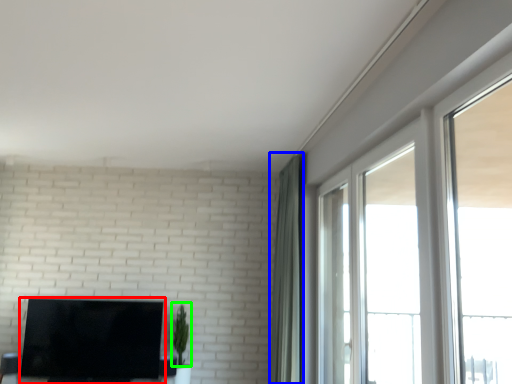
Question: Considering the real-world distances, which object is closest to television (highlighted by a red box)? curtain (highlighted by a blue box) or plant (highlighted by a green box).

Choices:
 (A) curtain
 (B) plant

Answer: (B)